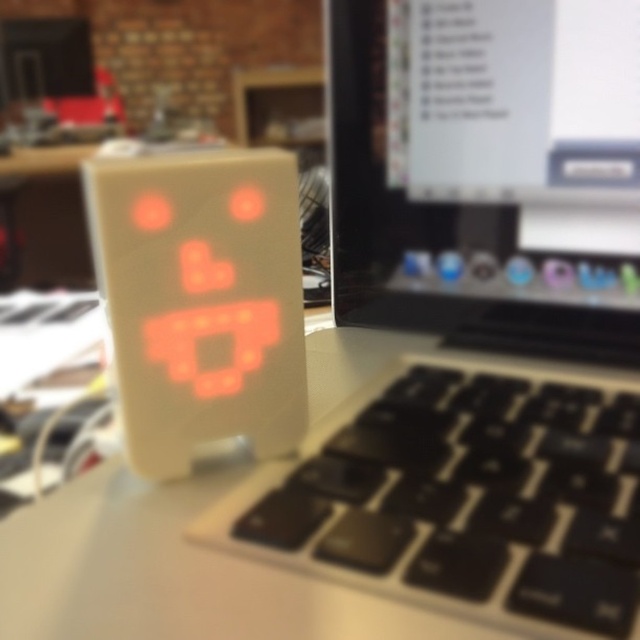
Question: Can you confirm if matte black laptop at center is positioned to the right of black plastic keyboard at lower right?

Choices:
 (A) no
 (B) yes

Answer: (B)

Question: Can you confirm if matte black laptop at center is positioned above black plastic keyboard at lower right?

Choices:
 (A) yes
 (B) no

Answer: (A)

Question: Which of the following is the closest to the observer?

Choices:
 (A) (412, 449)
 (B) (563, 141)

Answer: (A)

Question: Does matte black laptop at center come in front of black plastic keyboard at lower right?

Choices:
 (A) yes
 (B) no

Answer: (A)

Question: Among these objects, which one is nearest to the camera?

Choices:
 (A) matte black laptop at center
 (B) black plastic keyboard at lower right

Answer: (A)